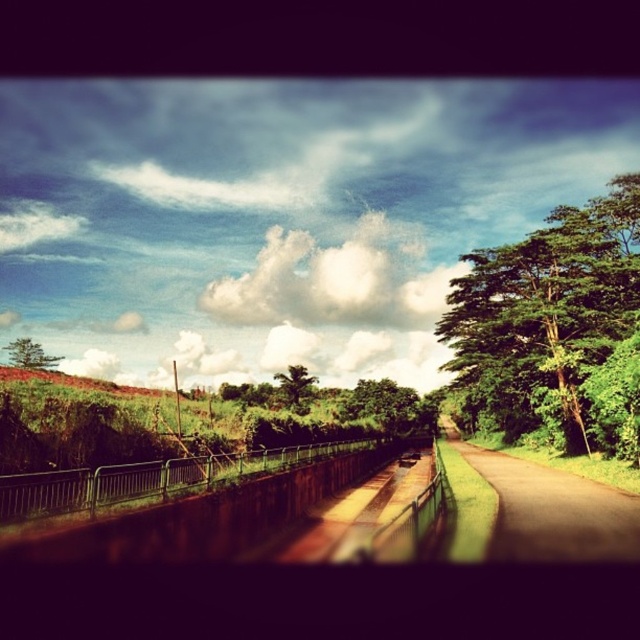
You are standing at the edge of the road and want to walk towards the distant landscape. Which of the two points, point (408, 280) or point (513, 500), is closer to you as you start walking?

Point (408, 280) is closer to you because it is further to the viewer than point (513, 500).

You are standing at the starting point of the road and want to reach the green leafy tree at right. Which direction should you walk to get there?

The green leafy tree at right is located at point (545,314), so you should walk towards the right side of the road to reach it.

You are a photographer planning to capture the entire scene in one shot. Given that the white fluffy cloud at upper center and the brown asphalt road at center must both be visible, which object should you ensure occupies more of the frame to include both?

The brown asphalt road at center should occupy more of the frame since it is larger than the white fluffy cloud at upper center, allowing both to be visible in the shot.